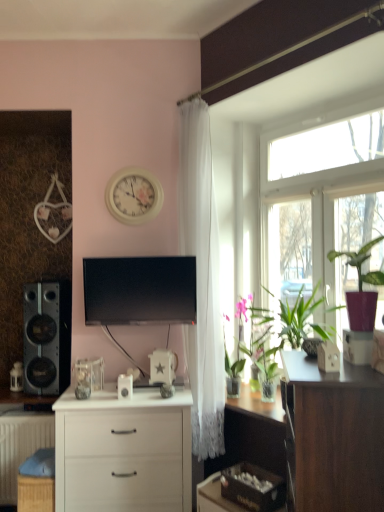
You are a GUI agent. You are given a task and a screenshot of the screen. Output one action in this format:
    pyautogui.click(x=<x>, y=<y>)
    Task: Click on the free point above transparent glass window at upper right (from a real-world perspective)
    The height and width of the screenshot is (512, 384).
    Given the screenshot: What is the action you would take?
    pyautogui.click(x=309, y=100)